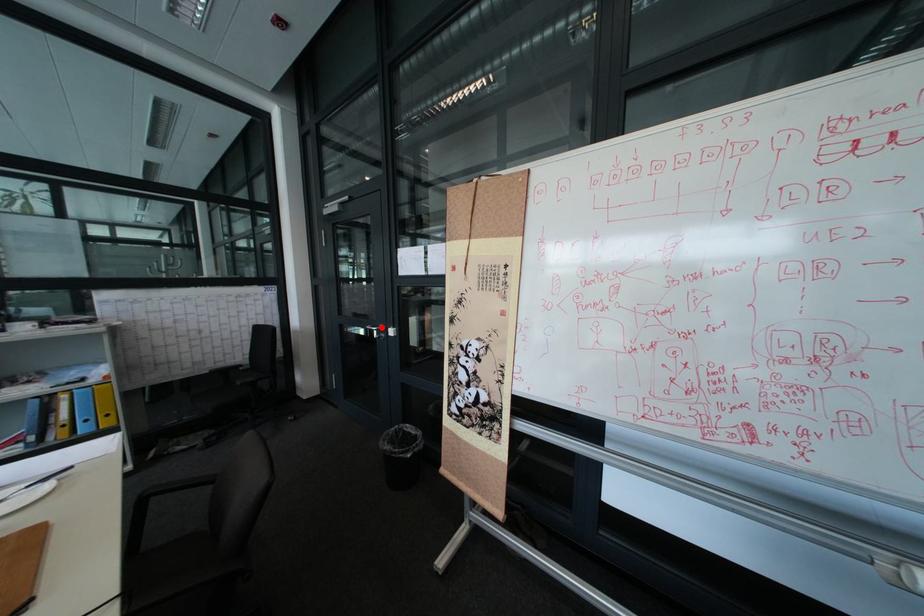
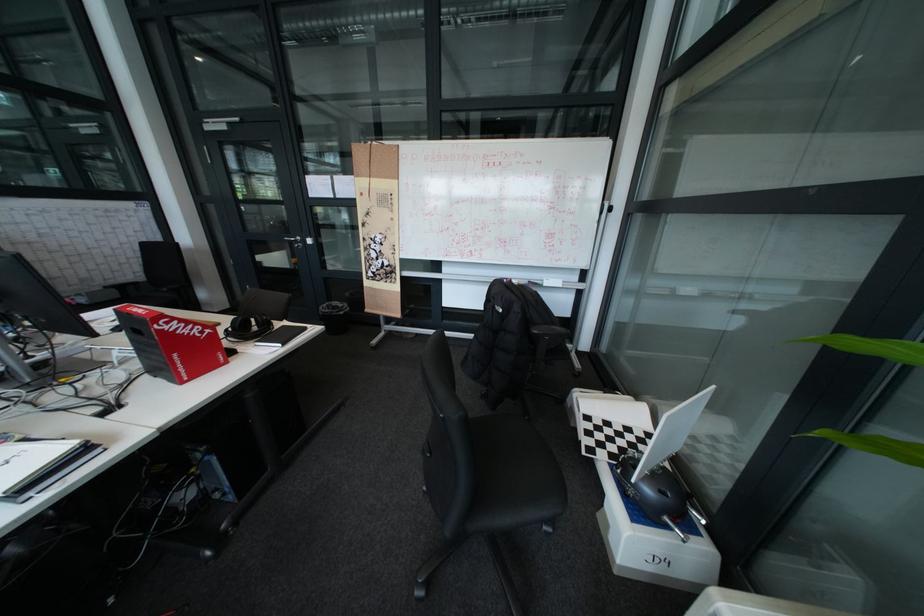
Find the pixel in the second image that matches the highlighted location in the first image.

(299, 238)